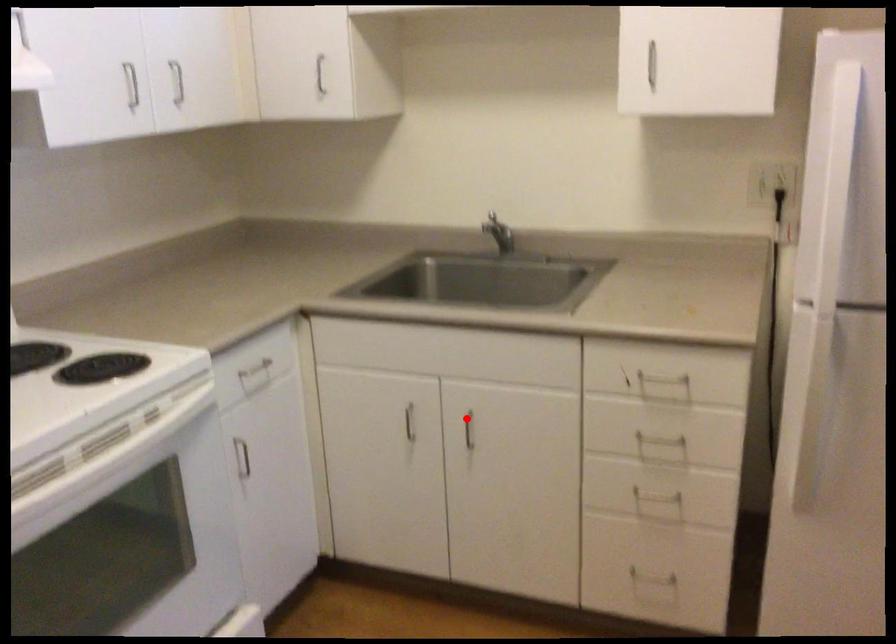
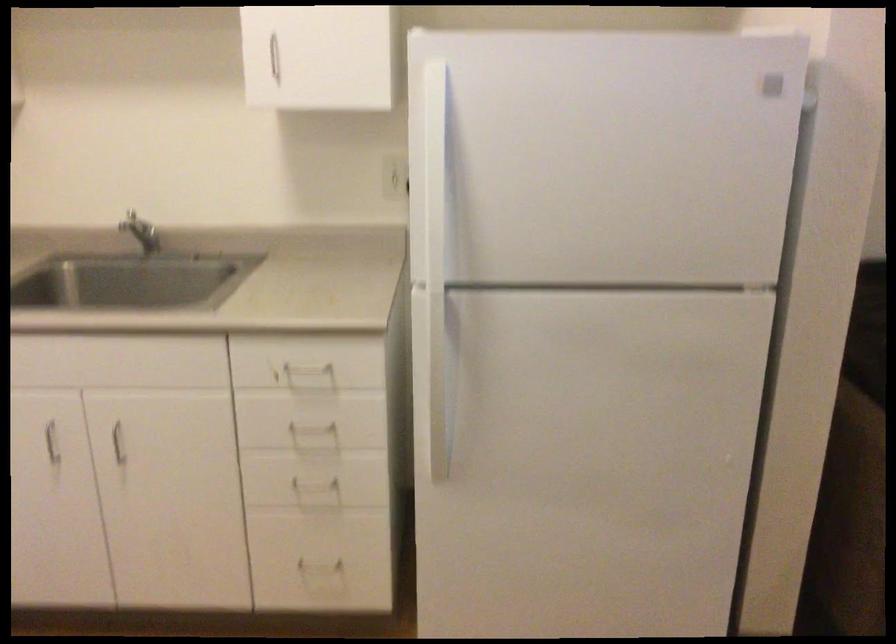
The point at the highlighted location is marked in the first image. Where is the corresponding point in the second image?

(116, 430)